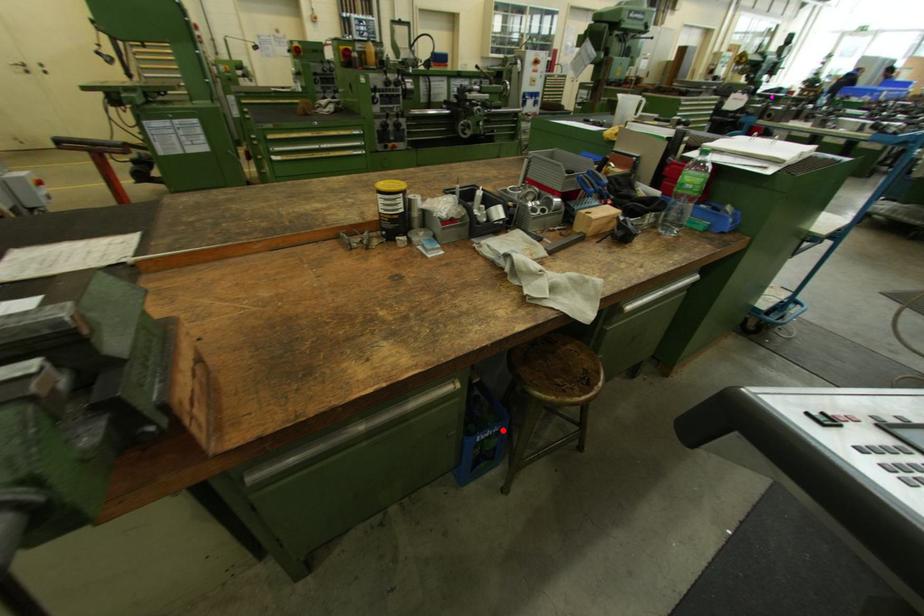
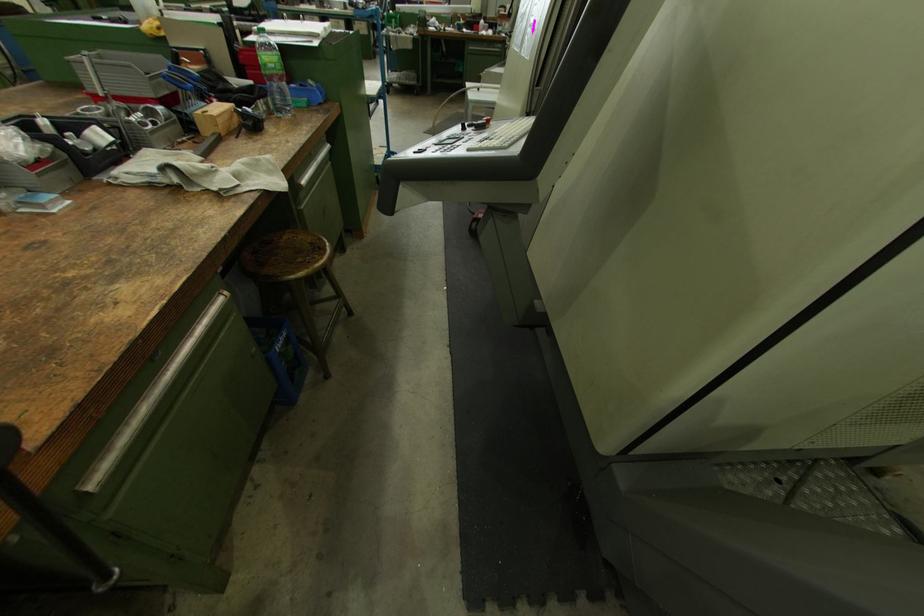
Question: A red point is marked in image1. In image2, is the corresponding 3D point closer to the camera or farther? Reply with the corresponding letter.

Choices:
 (A) The corresponding 3D point is closer.
 (B) The corresponding 3D point is farther.

Answer: (A)